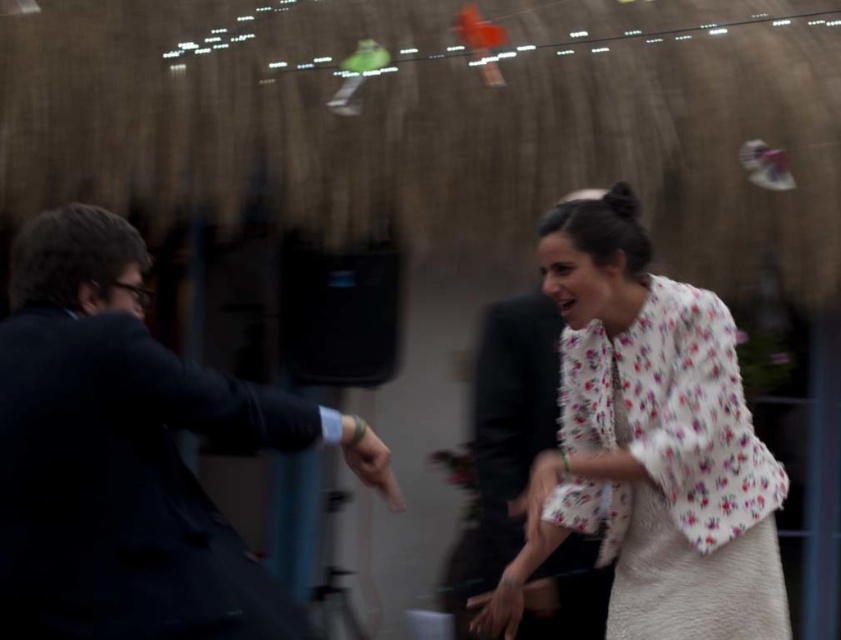
Question: Is white floral blouse at center in front of matte black hand at center?

Choices:
 (A) yes
 (B) no

Answer: (B)

Question: In this image, where is floral fabric blouse at center located relative to matte black hand at center?

Choices:
 (A) below
 (B) above

Answer: (B)

Question: Which object appears closest to the camera in this image?

Choices:
 (A) floral fabric blouse at center
 (B) white floral blouse at center
 (C) dark blue suit at left
 (D) matte black hand at center

Answer: (C)

Question: Considering the real-world distances, which object is closest to the floral fabric blouse at center?

Choices:
 (A) matte black hand at center
 (B) white floral blouse at center
 (C) dark blue suit at left

Answer: (B)

Question: Can you confirm if dark blue suit at left is smaller than floral fabric blouse at center?

Choices:
 (A) no
 (B) yes

Answer: (B)

Question: Which object is farther from the camera taking this photo?

Choices:
 (A) floral fabric blouse at center
 (B) white floral blouse at center
 (C) dark blue suit at left
 (D) matte black hand at center

Answer: (B)